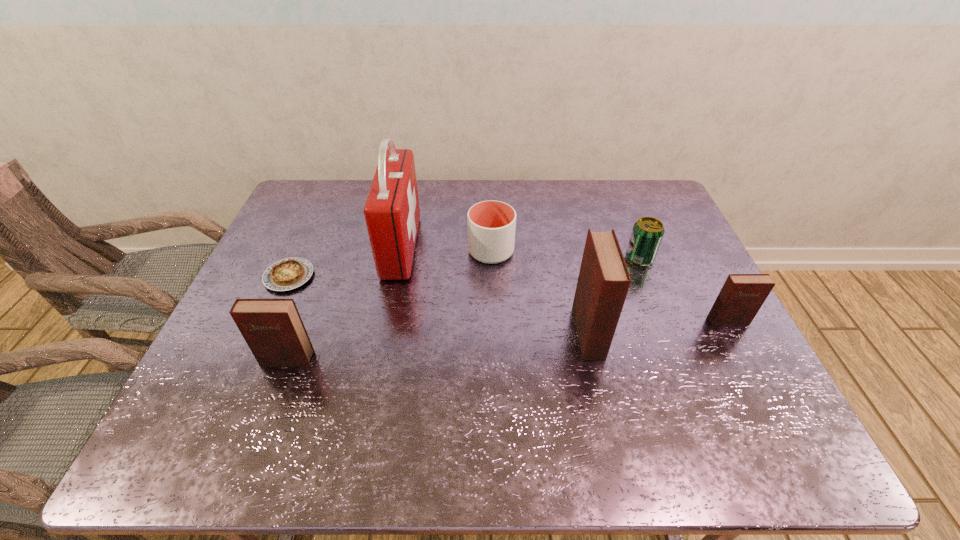
Find the location of a particular element. The height and width of the screenshot is (540, 960). free spot between the tallest object and the tallest diary is located at coordinates (494, 290).

I want to click on free space between the third object from left to right and the fourth object from right to left, so click(446, 249).

The height and width of the screenshot is (540, 960). Identify the location of vacant space that is in between the sixth object from left to right and the shortest object. (465, 267).

Image resolution: width=960 pixels, height=540 pixels. Find the location of `unoccupied area between the tallest object and the sixth shortest object`. unoccupied area between the tallest object and the sixth shortest object is located at coordinates (494, 290).

I want to click on vacant region between the rightmost object and the tallest object, so click(564, 284).

You are a GUI agent. You are given a task and a screenshot of the screen. Output one action in this format:
    pyautogui.click(x=<x>, y=<y>)
    Task: Click on the vacant area that lies between the second diary from right to left and the leftmost diary
    
    Given the screenshot: What is the action you would take?
    pyautogui.click(x=438, y=346)

Find the location of `free space between the third object from right to left and the shortest object`. free space between the third object from right to left and the shortest object is located at coordinates pyautogui.click(x=439, y=305).

At what (x,y) coordinates should I click in order to perform the action: click on vacant point located between the leftmost diary and the second object from right to left. Please return your answer as a coordinate pair (x, y). The height and width of the screenshot is (540, 960). Looking at the image, I should click on (464, 309).

Image resolution: width=960 pixels, height=540 pixels. In order to click on object that is the sixth closest to the beer can in this screenshot , I will do `click(287, 274)`.

Select which object is the fifth closest to the second diary from left to right. Please provide its 2D coordinates. Your answer should be formatted as a tuple, i.e. [(x, y)], where the tuple contains the x and y coordinates of a point satisfying the conditions above.

[(272, 328)]